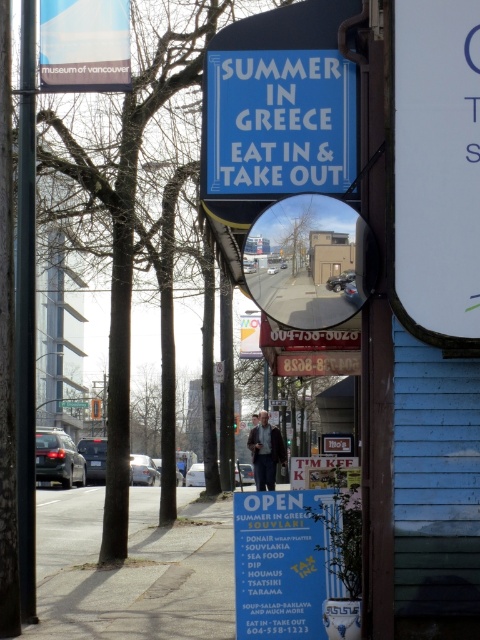
Looking at the storefront scene, which object is positioned to the right of the other between the white paper signboard at center and the green plastic street sign at upper center?

The white paper signboard at center is to the right of the green plastic street sign at upper center.

You are a delivery person trying to attach a flyer to a pole in the scene. The white paper at upper right is already on the black metal pole at left. Can you fit another flyer on the pole without overlapping the existing one?

The white paper at upper right is smaller than the black metal pole at left, so there is enough space to attach another flyer without overlapping the existing one.